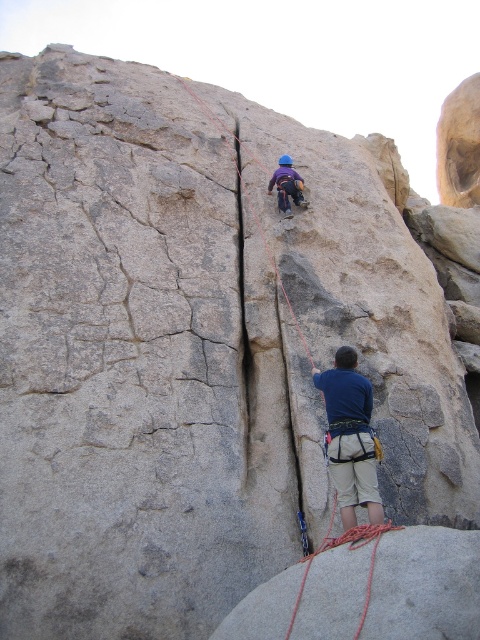
Does red nylon rope at lower right have a smaller size compared to matte purple helmet at upper center?

Incorrect, red nylon rope at lower right is not smaller in size than matte purple helmet at upper center.

Who is taller, red nylon rope at lower right or matte purple helmet at upper center?

With more height is matte purple helmet at upper center.

Which is behind, point (342, 540) or point (300, 205)?

Point (300, 205)

This screenshot has width=480, height=640. In order to click on red nylon rope at lower right in this screenshot , I will do `click(348, 548)`.

Does point (330, 444) come in front of point (288, 205)?

That is True.

Who is more distant from viewer, (335, 442) or (297, 193)?

The point (297, 193) is more distant.

Where is `blue fabric shirt at lower center`? The image size is (480, 640). blue fabric shirt at lower center is located at coordinates (x=349, y=436).

Describe the element at coordinates (349, 436) in the screenshot. The width and height of the screenshot is (480, 640). I see `blue fabric shirt at lower center` at that location.

Is blue fabric shirt at lower center in front of red nylon rope at lower right?

No, it is not.

Which is in front, point (335, 410) or point (361, 532)?

Point (361, 532) is more forward.

The width and height of the screenshot is (480, 640). What are the coordinates of `blue fabric shirt at lower center` in the screenshot? It's located at (349, 436).